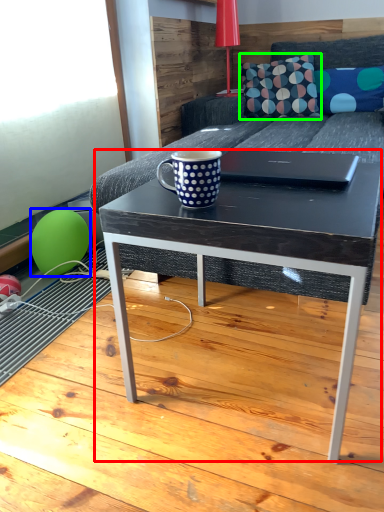
Question: Which object is the closest to the coffee table (highlighted by a red box)? Choose among these: balloon (highlighted by a blue box) or throw pillow (highlighted by a green box).

Choices:
 (A) balloon
 (B) throw pillow

Answer: (A)